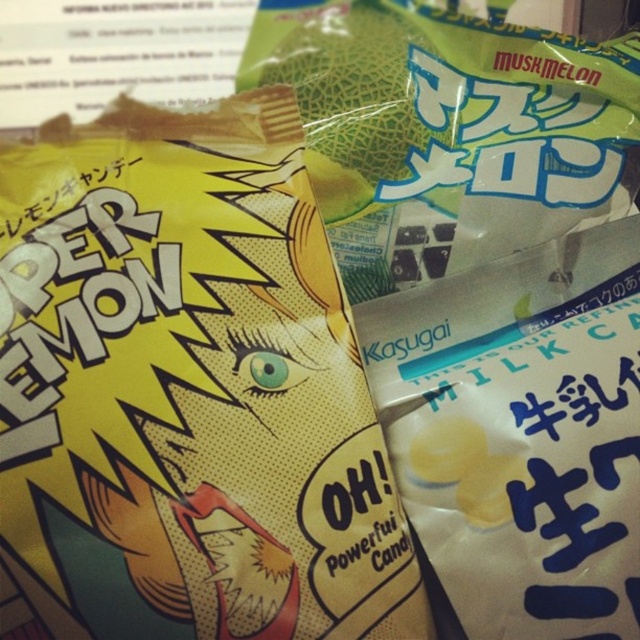
You are at a snack stand and want to buy the green melon at center. Which direction should you reach to grab it if the yellow glossy candy at center is blocking your view?

The green melon at center is to the right of the yellow glossy candy at center, so you should reach to the right to grab it.

You are a customer at a Japanese convenience store. You see two snacks in front of you, the yellow glossy candy at center and the green melon at center. Which one is positioned lower?

The yellow glossy candy at center is below the green melon at center, so it is positioned lower.

You are holding a yellow glossy candy at center and a green melon at center in your hands. Which one do you feel is nearer to your eyes?

The yellow glossy candy at center is closer to the viewer than the green melon at center, so you would feel the yellow glossy candy at center is nearer to your eyes.